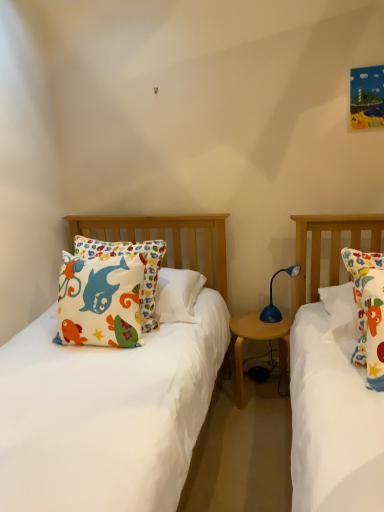
Question: Considering the relative positions of blue plastic lamp at center and wooden round table at center in the image provided, is blue plastic lamp at center to the left or to the right of wooden round table at center?

Choices:
 (A) left
 (B) right

Answer: (B)

Question: Looking at their shapes, would you say blue plastic lamp at center is wider or thinner than wooden round table at center?

Choices:
 (A) wide
 (B) thin

Answer: (B)

Question: Is point (264, 307) closer or farther from the camera than point (281, 321)?

Choices:
 (A) closer
 (B) farther

Answer: (B)

Question: Considering the positions of wooden round table at center and blue plastic lamp at center in the image, is wooden round table at center taller or shorter than blue plastic lamp at center?

Choices:
 (A) tall
 (B) short

Answer: (A)

Question: Relative to blue plastic lamp at center, is wooden round table at center in front or behind?

Choices:
 (A) front
 (B) behind

Answer: (B)

Question: Looking at the image, does wooden round table at center seem bigger or smaller compared to blue plastic lamp at center?

Choices:
 (A) small
 (B) big

Answer: (B)

Question: Considering the positions of wooden round table at center and blue plastic lamp at center in the image, is wooden round table at center wider or thinner than blue plastic lamp at center?

Choices:
 (A) wide
 (B) thin

Answer: (A)